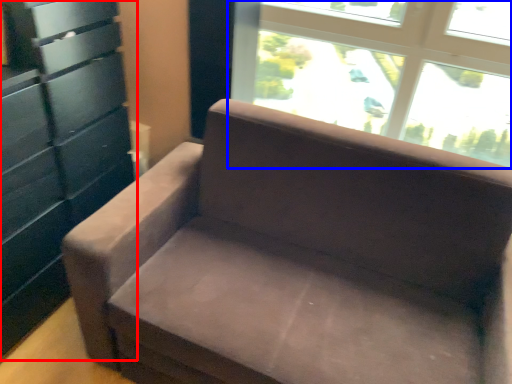
Question: Among these objects, which one is farthest to the camera, dresser (highlighted by a red box) or window (highlighted by a blue box)?

Choices:
 (A) dresser
 (B) window

Answer: (B)